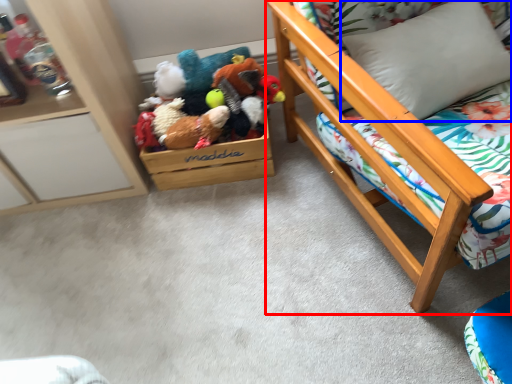
Question: Which object appears farthest to the camera in this image, furniture (highlighted by a red box) or pillow (highlighted by a blue box)?

Choices:
 (A) furniture
 (B) pillow

Answer: (B)